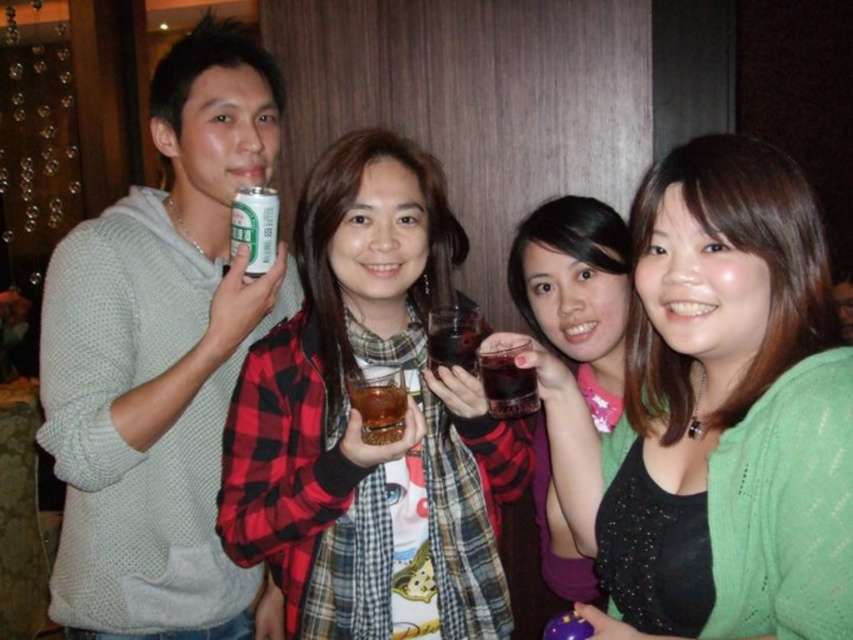
Measure the distance between matte black glass at center and green matte can at upper left.

The distance of matte black glass at center from green matte can at upper left is 65.59 centimeters.

Who is shorter, matte black glass at center or green matte can at upper left?

With less height is green matte can at upper left.

In order to click on matte black glass at center in this screenshot , I will do `click(577, 292)`.

Identify the location of matte black glass at center. This screenshot has height=640, width=853. (577, 292).

Does white knitted sweater at upper left have a lesser height compared to translucent glass cup at center?

No, white knitted sweater at upper left is not shorter than translucent glass cup at center.

Does white knitted sweater at upper left have a greater height compared to translucent glass cup at center?

Correct, white knitted sweater at upper left is much taller as translucent glass cup at center.

You are a GUI agent. You are given a task and a screenshot of the screen. Output one action in this format:
    pyautogui.click(x=<x>, y=<y>)
    Task: Click on the white knitted sweater at upper left
    This screenshot has width=853, height=640.
    Given the screenshot: What is the action you would take?
    pyautogui.click(x=161, y=362)

Between green matte can at upper left and translucent glass at center, which one has less height?

translucent glass at center

Describe the element at coordinates (254, 227) in the screenshot. This screenshot has width=853, height=640. I see `green matte can at upper left` at that location.

Image resolution: width=853 pixels, height=640 pixels. I want to click on green matte can at upper left, so click(254, 227).